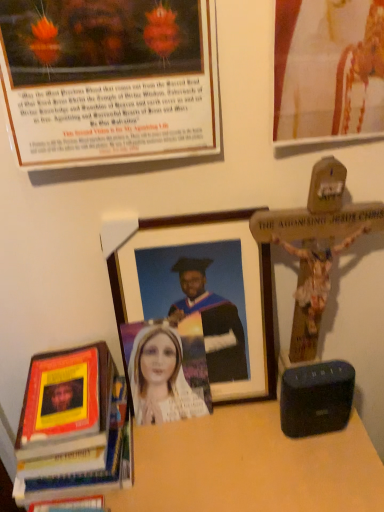
Question: From a real-world perspective, is wooden table at lower center positioned above or below matte plastic portrait at center?

Choices:
 (A) above
 (B) below

Answer: (B)

Question: Do you think wooden table at lower center is within matte plastic portrait at center, or outside of it?

Choices:
 (A) outside
 (B) inside

Answer: (A)

Question: Estimate the real-world distances between objects in this image. Which object is closer to the wooden table at lower center?

Choices:
 (A) matte wooden picture frame at upper left, which is the 2th picture frame in bottom-to-top order
 (B) hardcover book at lower left
 (C) wooden picture frame at center, acting as the 1th picture frame starting from the bottom
 (D) black plastic speaker at lower right
 (E) matte gold picture frame at upper right, the 3th picture frame positioned from the bottom

Answer: (D)

Question: Estimate the real-world distances between objects in this image. Which object is farther from the black plastic speaker at lower right?

Choices:
 (A) matte gold picture frame at upper right, the 3th picture frame positioned from the bottom
 (B) matte wooden picture frame at upper left, the 2th picture frame in the top-to-bottom sequence
 (C) wooden picture frame at center, placed as the third picture frame when sorted from top to bottom
 (D) wooden table at lower center
 (E) hardcover book at lower left

Answer: (B)